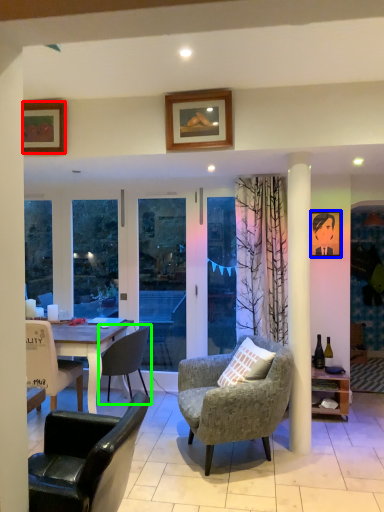
Question: Which is nearer to the picture frame (highlighted by a red box)? picture frame (highlighted by a blue box) or chair (highlighted by a green box).

Choices:
 (A) picture frame
 (B) chair

Answer: (B)